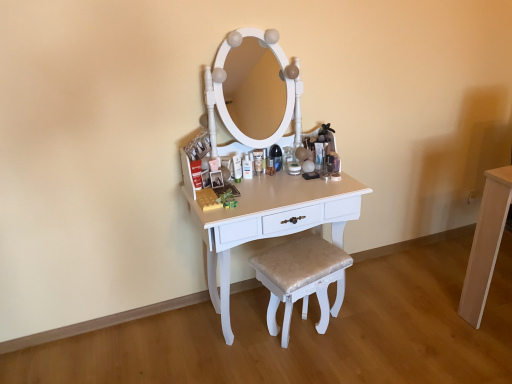
Where is `free location to the right of shiny beige cushioned stool at center`? This screenshot has height=384, width=512. free location to the right of shiny beige cushioned stool at center is located at coordinates (367, 336).